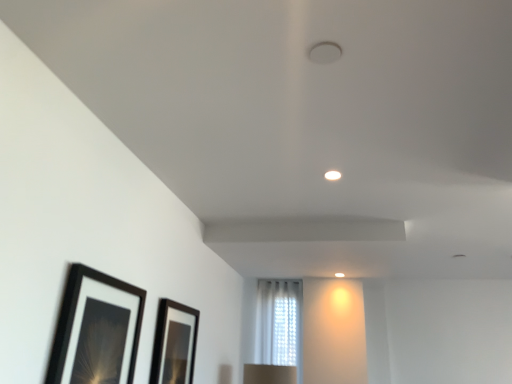
Question: Is white sheer curtain at center bigger or smaller than black matte picture frame at lower left, placed as the 2th picture frame when sorted from right to left?

Choices:
 (A) small
 (B) big

Answer: (B)

Question: Considering their positions, is white sheer curtain at center located in front of or behind black matte picture frame at lower left, positioned as the first picture frame in left-to-right order?

Choices:
 (A) front
 (B) behind

Answer: (B)

Question: Which is nearer to the black matte picture frame at lower left, positioned as the first picture frame in left-to-right order?

Choices:
 (A) white sheer curtain at center
 (B) black glossy picture frame at lower center, the 1th picture frame positioned from the right

Answer: (B)

Question: Which object is the closest to the white sheer curtain at center?

Choices:
 (A) black matte picture frame at lower left, placed as the 2th picture frame when sorted from right to left
 (B) black glossy picture frame at lower center, the 1th picture frame positioned from the right

Answer: (B)